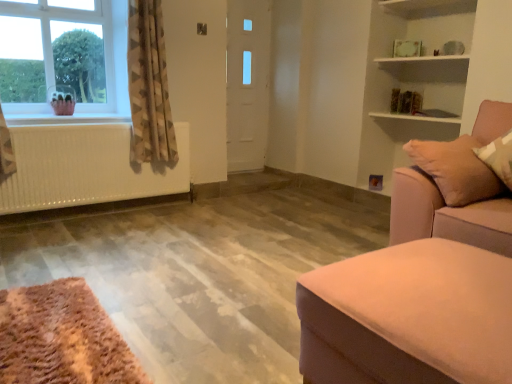
In order to face suede-like beige studio couch at right, the 2th studio couch positioned from the front, should I rotate leftwards or rightwards?

A 29.644 degree turn to the right will do.

The image size is (512, 384). What do you see at coordinates (64, 57) in the screenshot? I see `clear glass window at upper left` at bounding box center [64, 57].

Find the location of a particular element. white glossy door at center is located at coordinates (247, 83).

You are a GUI agent. You are given a task and a screenshot of the screen. Output one action in this format:
    pyautogui.click(x=<x>, y=<y>)
    Task: Click on the suede-like beige studio couch at right, the 2th studio couch positioned from the front
    
    Given the screenshot: What is the action you would take?
    click(448, 214)

From a real-world perspective, between white glossy door at center and beige textured curtain at left, who is vertically higher?

beige textured curtain at left is physically above.

From the image's perspective, is white glossy door at center positioned above or below beige textured curtain at left?

white glossy door at center is situated higher than beige textured curtain at left in the image.

Considering the sizes of objects white glossy door at center and beige textured curtain at left in the image provided, who is smaller, white glossy door at center or beige textured curtain at left?

With smaller size is white glossy door at center.

Can you tell me how much white glossy door at center and beige textured curtain at left differ in facing direction?

The angular difference between white glossy door at center and beige textured curtain at left is 2.26 degrees.

Is suede-like pink ottoman at lower right, the second studio couch positioned from the back, positioned behind white glossy door at center?

No, it is in front of white glossy door at center.

Considering the points (324, 332) and (234, 2), which point is behind, point (324, 332) or point (234, 2)?

The point (234, 2) is more distant.

Based on their sizes in the image, would you say suede-like pink ottoman at lower right, marked as the 1th studio couch in a front-to-back arrangement, is bigger or smaller than white glossy door at center?

In the image, suede-like pink ottoman at lower right, marked as the 1th studio couch in a front-to-back arrangement, appears to be larger than white glossy door at center.

Would you consider suede-like pink ottoman at lower right, marked as the 1th studio couch in a front-to-back arrangement, to be distant from white glossy door at center?

Indeed, suede-like pink ottoman at lower right, marked as the 1th studio couch in a front-to-back arrangement, is not near white glossy door at center.

Considering the relative sizes of white matte radiator at left and suede-like pink ottoman at lower right, marked as the 1th studio couch in a front-to-back arrangement, in the image provided, is white matte radiator at left thinner than suede-like pink ottoman at lower right, marked as the 1th studio couch in a front-to-back arrangement,?

Yes, white matte radiator at left is thinner than suede-like pink ottoman at lower right, marked as the 1th studio couch in a front-to-back arrangement.

Which of these two, white matte radiator at left or suede-like pink ottoman at lower right, marked as the 1th studio couch in a front-to-back arrangement, is smaller?

Smaller between the two is white matte radiator at left.

Considering the sizes of objects white matte radiator at left and suede-like pink ottoman at lower right, marked as the 1th studio couch in a front-to-back arrangement, in the image provided, who is taller, white matte radiator at left or suede-like pink ottoman at lower right, marked as the 1th studio couch in a front-to-back arrangement,?

white matte radiator at left is taller.

Which object is further away from the camera, white matte radiator at left or suede-like pink ottoman at lower right, marked as the 1th studio couch in a front-to-back arrangement?

Positioned behind is white matte radiator at left.

What's the angular difference between suede-like beige studio couch at right, the 2th studio couch positioned from the front, and beige textured curtain at left's facing directions?

The facing directions of suede-like beige studio couch at right, the 2th studio couch positioned from the front, and beige textured curtain at left are 91.2 degrees apart.

How much distance is there between suede-like beige studio couch at right, the 2th studio couch positioned from the front, and beige textured curtain at left?

2.06 meters.

Which is nearer, [398,212] or [142,11]?

Point [398,212] appears to be closer to the viewer than point [142,11].

Considering the positions of objects suede-like beige studio couch at right, the 2th studio couch positioned from the front, and beige textured curtain at left in the image provided, who is more to the left, suede-like beige studio couch at right, the 2th studio couch positioned from the front, or beige textured curtain at left?

From the viewer's perspective, beige textured curtain at left appears more on the left side.

Are white glossy door at center and suede-like pink ottoman at lower right, marked as the 1th studio couch in a front-to-back arrangement, located far from each other?

That's right, there is a large distance between white glossy door at center and suede-like pink ottoman at lower right, marked as the 1th studio couch in a front-to-back arrangement.

From the picture: Is white glossy door at center facing towards suede-like pink ottoman at lower right, marked as the 1th studio couch in a front-to-back arrangement?

No, white glossy door at center is not oriented towards suede-like pink ottoman at lower right, marked as the 1th studio couch in a front-to-back arrangement.

From the image's perspective, does white glossy door at center appear higher than suede-like pink ottoman at lower right, marked as the 1th studio couch in a front-to-back arrangement?

Correct, white glossy door at center appears higher than suede-like pink ottoman at lower right, marked as the 1th studio couch in a front-to-back arrangement, in the image.

Measure the distance from white glossy door at center to suede-like pink ottoman at lower right, marked as the 1th studio couch in a front-to-back arrangement.

They are 9.78 feet apart.

Is suede-like pink ottoman at lower right, marked as the 1th studio couch in a front-to-back arrangement, directly adjacent to suede-like beige studio couch at right, the 2th studio couch positioned from the front?

No, suede-like pink ottoman at lower right, marked as the 1th studio couch in a front-to-back arrangement, is not touching suede-like beige studio couch at right, the 2th studio couch positioned from the front.

Which is closer, (423,175) or (450,235)?

The point (450,235) is more forward.

Considering the relative sizes of white glossy door at center and suede-like beige studio couch at right, which is the 1th studio couch from back to front, in the image provided, is white glossy door at center shorter than suede-like beige studio couch at right, which is the 1th studio couch from back to front,?

No.

From the image's perspective, which is below, white glossy door at center or suede-like beige studio couch at right, the 2th studio couch positioned from the front?

suede-like beige studio couch at right, the 2th studio couch positioned from the front, appears lower in the image.

Is white glossy door at center located outside suede-like beige studio couch at right, the 2th studio couch positioned from the front?

white glossy door at center is positioned outside suede-like beige studio couch at right, the 2th studio couch positioned from the front.

Could you tell me if white glossy door at center is facing suede-like beige studio couch at right, which is the 1th studio couch from back to front?

Yes, white glossy door at center is aimed at suede-like beige studio couch at right, which is the 1th studio couch from back to front.

You are a GUI agent. You are given a task and a screenshot of the screen. Output one action in this format:
    pyautogui.click(x=<x>, y=<y>)
    Task: Click on the curtain in front of the white glossy door at center
    The height and width of the screenshot is (384, 512).
    Given the screenshot: What is the action you would take?
    pyautogui.click(x=149, y=86)

There is a white glossy door at center. Where is `the 2nd studio couch below it (from a real-world perspective)`? Image resolution: width=512 pixels, height=384 pixels. the 2nd studio couch below it (from a real-world perspective) is located at coordinates (416, 297).

Based on their spatial positions, is suede-like pink ottoman at lower right, the second studio couch positioned from the back, or white matte radiator at left closer to white glossy door at center?

The object closer to white glossy door at center is white matte radiator at left.

Which object lies further to the anchor point suede-like pink ottoman at lower right, the second studio couch positioned from the back, white glossy door at center or clear glass window at upper left?

The object further to suede-like pink ottoman at lower right, the second studio couch positioned from the back, is white glossy door at center.

Based on their spatial positions, is clear glass window at upper left or suede-like beige studio couch at right, which is the 1th studio couch from back to front, further from white matte radiator at left?

suede-like beige studio couch at right, which is the 1th studio couch from back to front, lies further to white matte radiator at left than the other object.

Looking at this image, which object lies further to the anchor point white matte radiator at left, beige textured curtain at left or suede-like beige studio couch at right, the 2th studio couch positioned from the front?

The object further to white matte radiator at left is suede-like beige studio couch at right, the 2th studio couch positioned from the front.

Looking at the image, which one is located closer to beige textured curtain at left, suede-like pink ottoman at lower right, marked as the 1th studio couch in a front-to-back arrangement, or suede-like beige studio couch at right, the 2th studio couch positioned from the front?

The object closer to beige textured curtain at left is suede-like beige studio couch at right, the 2th studio couch positioned from the front.

Which object lies further to the anchor point suede-like pink ottoman at lower right, marked as the 1th studio couch in a front-to-back arrangement, clear glass window at upper left or beige textured curtain at left?

clear glass window at upper left lies further to suede-like pink ottoman at lower right, marked as the 1th studio couch in a front-to-back arrangement, than the other object.

From the image, which object appears to be farther from beige textured curtain at left, suede-like pink ottoman at lower right, marked as the 1th studio couch in a front-to-back arrangement, or white matte radiator at left?

suede-like pink ottoman at lower right, marked as the 1th studio couch in a front-to-back arrangement, is positioned further to the anchor beige textured curtain at left.

From the image, which object appears to be nearer to beige textured curtain at left, suede-like beige studio couch at right, which is the 1th studio couch from back to front, or white glossy door at center?

white glossy door at center is closer to beige textured curtain at left.

The height and width of the screenshot is (384, 512). Identify the location of radiator between suede-like pink ottoman at lower right, marked as the 1th studio couch in a front-to-back arrangement, and beige textured curtain at left from front to back. (85, 167).

At what (x,y) coordinates should I click in order to perform the action: click on curtain located between clear glass window at upper left and suede-like beige studio couch at right, the 2th studio couch positioned from the front, in the left-right direction. Please return your answer as a coordinate pair (x, y). The width and height of the screenshot is (512, 384). Looking at the image, I should click on (149, 86).

Where is `curtain that lies between clear glass window at upper left and white matte radiator at left from top to bottom`? curtain that lies between clear glass window at upper left and white matte radiator at left from top to bottom is located at coordinates (149, 86).

Find the location of a particular element. radiator between clear glass window at upper left and suede-like pink ottoman at lower right, marked as the 1th studio couch in a front-to-back arrangement, from left to right is located at coordinates (x=85, y=167).